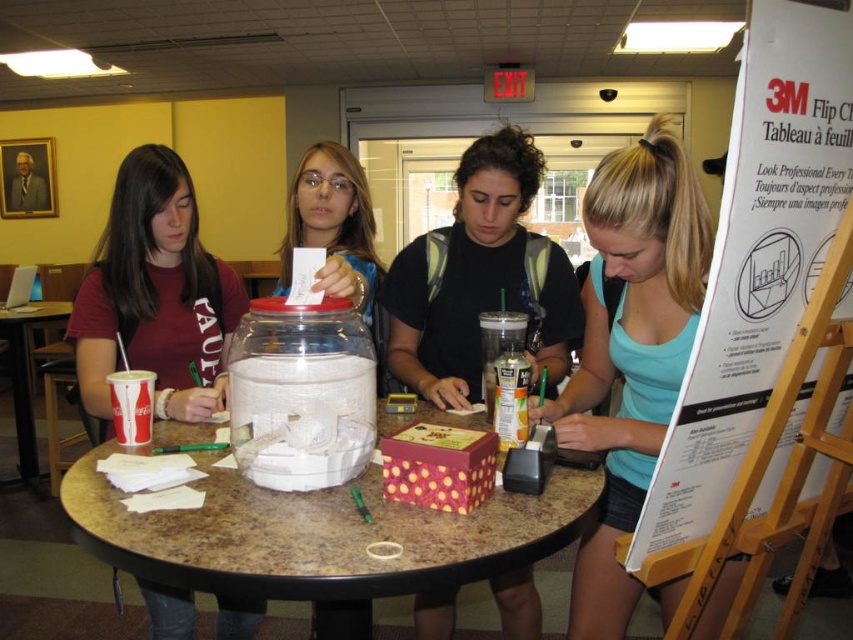
Question: Does light blue tank top at center have a greater width compared to matte red shirt at left?

Choices:
 (A) no
 (B) yes

Answer: (A)

Question: Does white paperboard at right appear on the right side of marble-patterned table at center?

Choices:
 (A) yes
 (B) no

Answer: (A)

Question: Estimate the real-world distances between objects in this image. Which object is closer to the brown wood table at lower left?

Choices:
 (A) light blue tank top at center
 (B) white paperboard at right

Answer: (A)

Question: Which object is farther from the camera taking this photo?

Choices:
 (A) white paperboard at right
 (B) brown wood table at lower left
 (C) matte red shirt at left
 (D) light blue tank top at center

Answer: (B)

Question: Does marble-patterned table at center lie behind light blue tank top at center?

Choices:
 (A) no
 (B) yes

Answer: (A)

Question: Which point is closer to the camera taking this photo?

Choices:
 (A) [x=24, y=362]
 (B) [x=584, y=557]

Answer: (B)